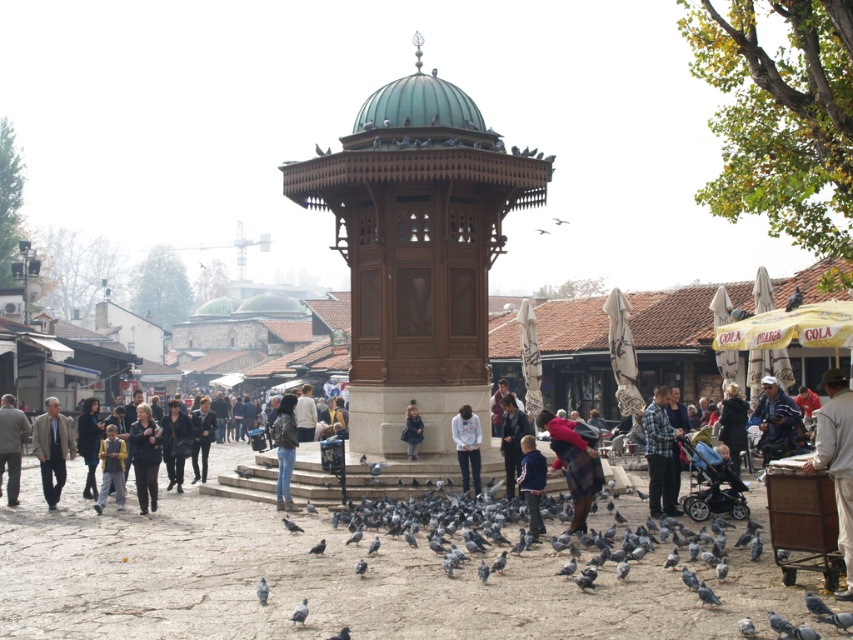
Measure the distance between white plastic bag at lower right and camera.

They are 35.34 meters apart.

Between point (817, 435) and point (212, 420), which one is positioned behind?

The point (212, 420) is behind.

Where is `white plastic bag at lower right`? This screenshot has height=640, width=853. white plastic bag at lower right is located at coordinates (836, 460).

Between plaid fabric child at center and gray matte pigeon at center, which one appears on the left side from the viewer's perspective?

gray matte pigeon at center is more to the left.

Is plaid fabric child at center positioned at the back of gray matte pigeon at center?

That is True.

Who is more forward, (582, 445) or (292, 618)?

Point (292, 618)

Identify the location of plaid fabric child at center. (573, 464).

Does dark blue leather jacket at center have a lesser height compared to dark blue fabric jacket at center?

In fact, dark blue leather jacket at center may be taller than dark blue fabric jacket at center.

Is point (183, 428) in front of point (408, 426)?

No, (183, 428) is further to viewer.

Does point (172, 406) come behind point (405, 442)?

Yes, it is behind point (405, 442).

The image size is (853, 640). What are the coordinates of `dark blue leather jacket at center` in the screenshot? It's located at (175, 442).